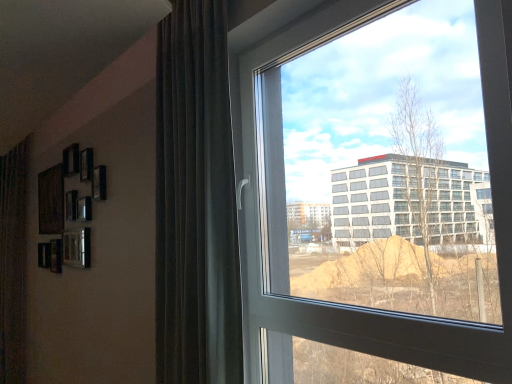
Question: Can you confirm if transparent glass window at center is positioned to the left of dark brown velvet curtain at left?

Choices:
 (A) no
 (B) yes

Answer: (A)

Question: Considering the relative sizes of transparent glass window at center and dark brown velvet curtain at left in the image provided, is transparent glass window at center bigger than dark brown velvet curtain at left?

Choices:
 (A) yes
 (B) no

Answer: (B)

Question: Is dark brown velvet curtain at left surrounded by transparent glass window at center?

Choices:
 (A) yes
 (B) no

Answer: (B)

Question: Can you confirm if transparent glass window at center is smaller than dark brown velvet curtain at left?

Choices:
 (A) yes
 (B) no

Answer: (A)

Question: Is transparent glass window at center to the right of dark brown velvet curtain at left from the viewer's perspective?

Choices:
 (A) yes
 (B) no

Answer: (A)

Question: Does transparent glass window at center have a greater width compared to dark brown velvet curtain at left?

Choices:
 (A) yes
 (B) no

Answer: (B)

Question: From a real-world perspective, is dark brown velvet curtain at left on top of transparent glass window at center?

Choices:
 (A) no
 (B) yes

Answer: (B)

Question: Is dark brown velvet curtain at left turned away from transparent glass window at center?

Choices:
 (A) no
 (B) yes

Answer: (A)

Question: Would you say dark brown velvet curtain at left is outside transparent glass window at center?

Choices:
 (A) no
 (B) yes

Answer: (B)

Question: Is the position of dark brown velvet curtain at left less distant than that of transparent glass window at center?

Choices:
 (A) yes
 (B) no

Answer: (B)

Question: From the image's perspective, is dark brown velvet curtain at left beneath transparent glass window at center?

Choices:
 (A) no
 (B) yes

Answer: (A)

Question: Are dark brown velvet curtain at left and transparent glass window at center far apart?

Choices:
 (A) no
 (B) yes

Answer: (A)

Question: From a real-world perspective, is dark brown velvet curtain at left physically located above or below transparent glass window at center?

Choices:
 (A) below
 (B) above

Answer: (B)